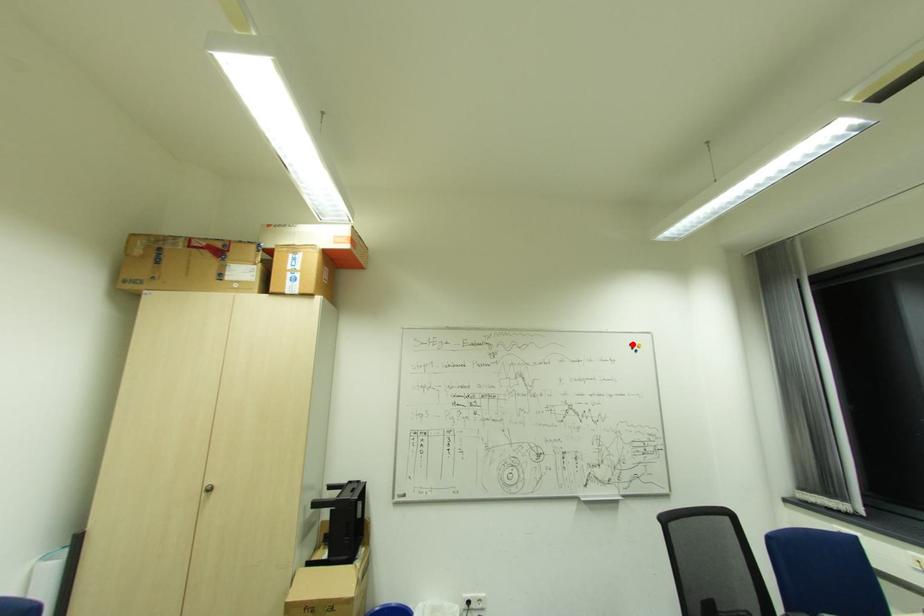
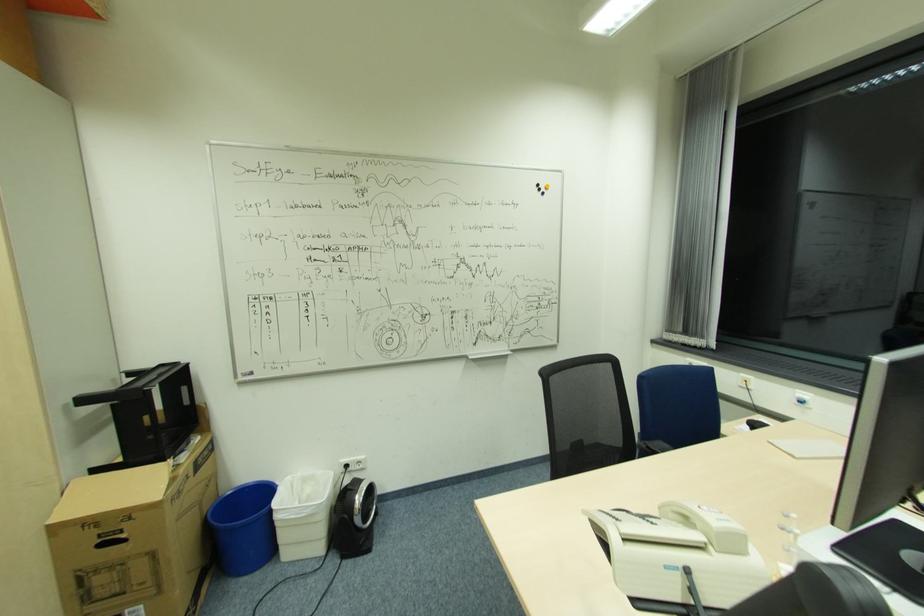
Question: I am providing you with two images of the same scene from different viewpoints. Image1 has a red point marked. In image2, the corresponding 3D location appears at what relative position? Reply with the corresponding letter.

Choices:
 (A) Closer
 (B) Farther

Answer: (A)